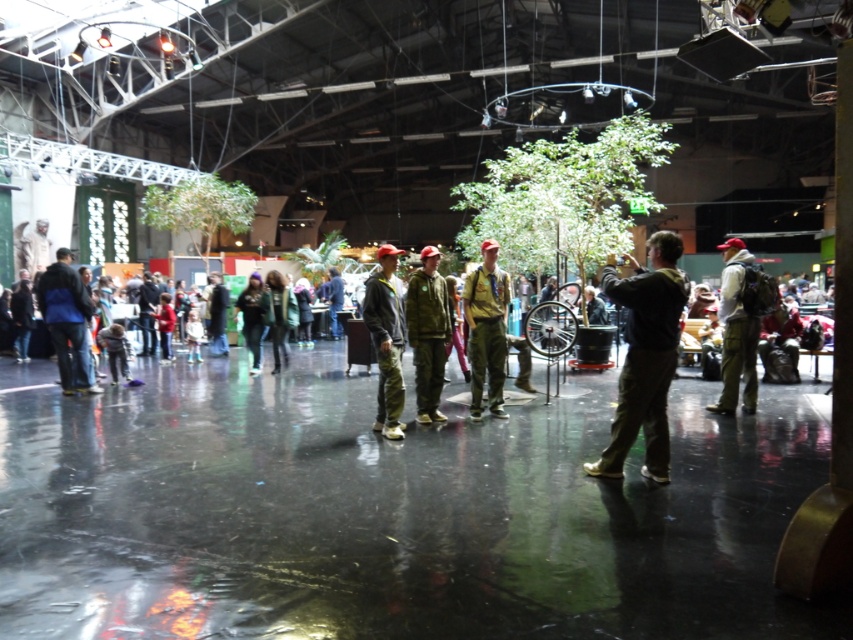
You are a photographer in the event space and need to capture a photo that includes both the dark green uniform at center and the matte khaki pants at right. Based on their positions, which object should be placed to the left in your camera frame?

The dark green uniform at center is positioned on the left side of matte khaki pants at right, so in the camera frame, the dark green uniform at center should be placed to the left of the matte khaki pants at right.

You are a photographer at the event and want to capture both the dark green uniform at center and the camouflage fabric jacket at center in the same frame. Which one should you focus on first to ensure both are in the shot?

The dark green uniform at center is positioned on the right side of camouflage fabric jacket at center, so you should focus on the camouflage fabric jacket at center first to ensure both are included in the frame.